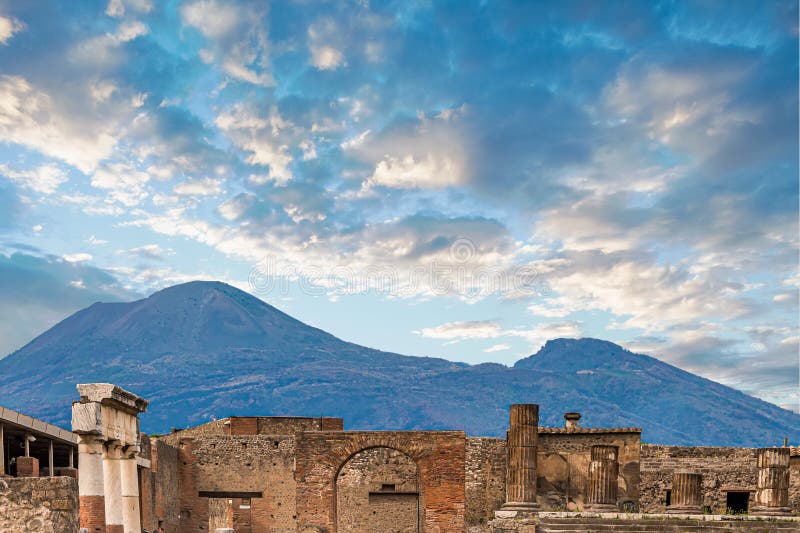
The height and width of the screenshot is (533, 800). I want to click on wall, so click(x=481, y=465).